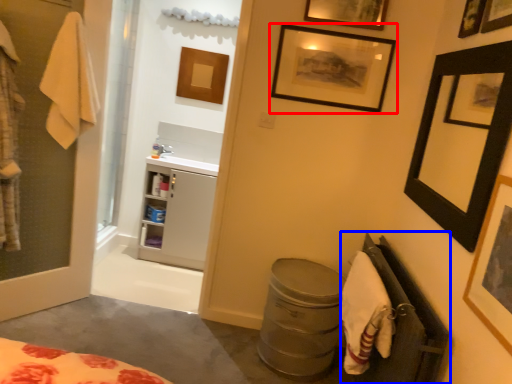
Question: Which object appears farthest to the camera in this image, picture frame (highlighted by a red box) or closet (highlighted by a blue box)?

Choices:
 (A) picture frame
 (B) closet

Answer: (A)